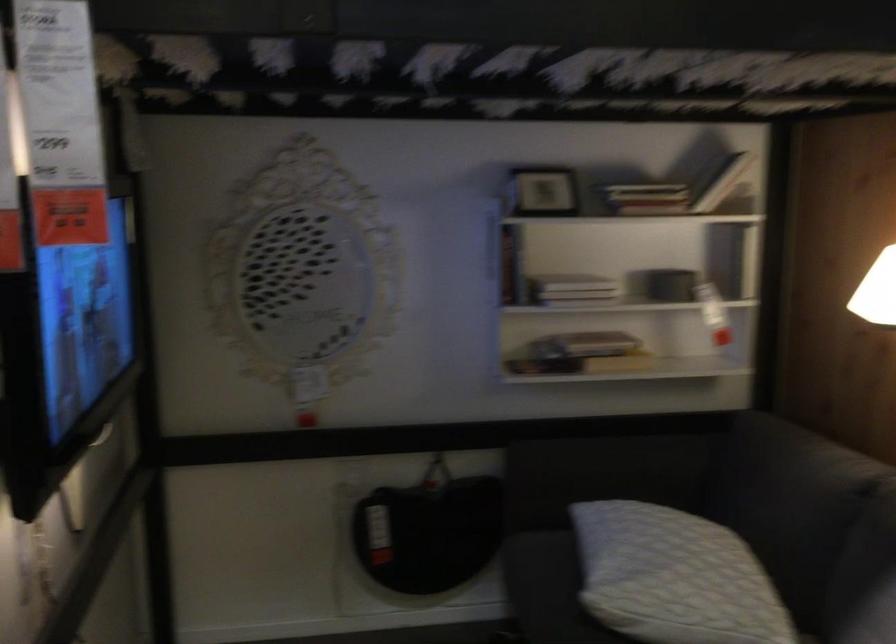
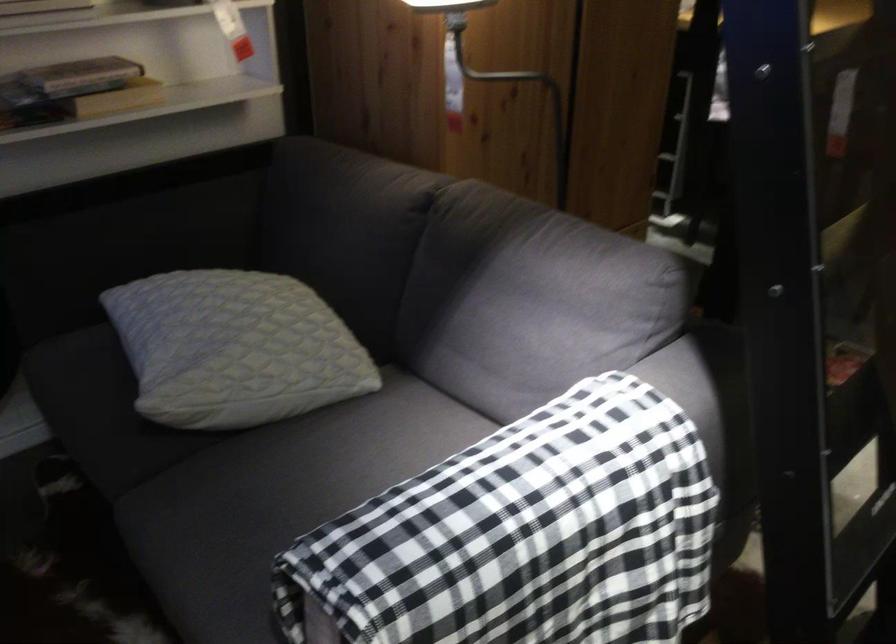
The images are taken continuously from a first-person perspective. In which direction is your viewpoint rotating?

The camera's rotation is toward right-down.